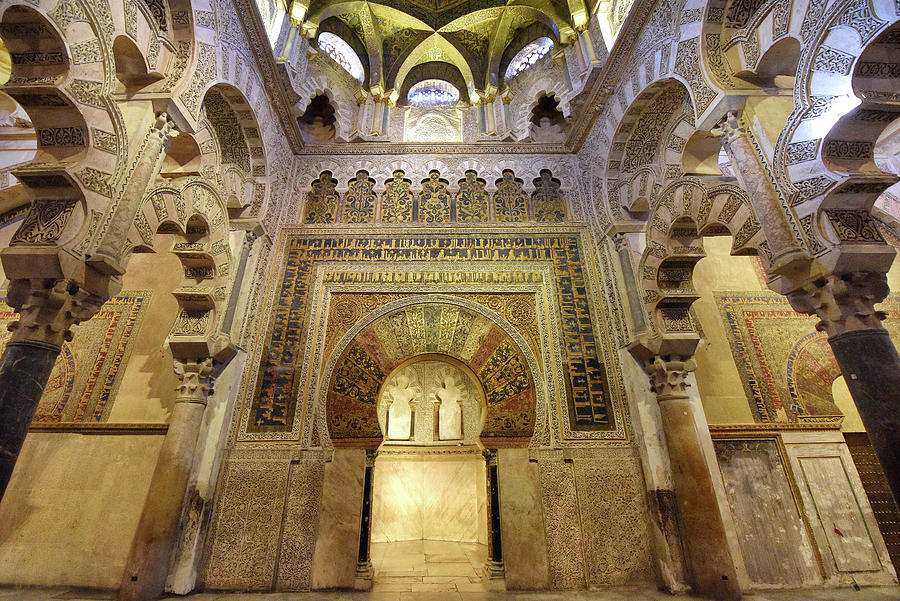
Find the location of `stone floor`. stone floor is located at coordinates (45, 592), (418, 595), (814, 596).